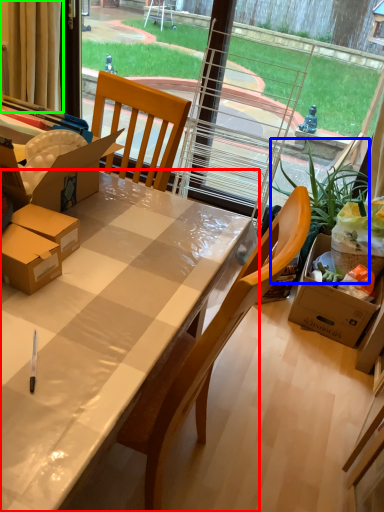
Question: Considering the real-world distances, which object is closest to desk (highlighted by a red box)? houseplant (highlighted by a blue box) or curtain (highlighted by a green box).

Choices:
 (A) houseplant
 (B) curtain

Answer: (A)